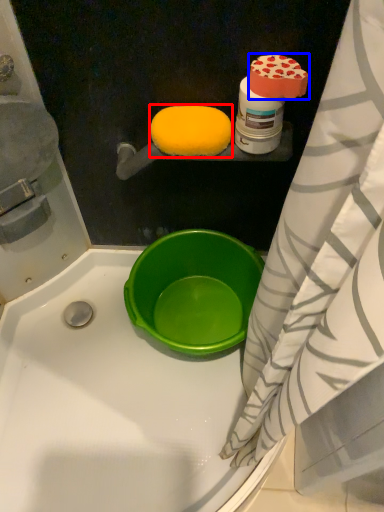
Question: Which object appears closest to the camera in this image, food (highlighted by a red box) or food (highlighted by a blue box)?

Choices:
 (A) food
 (B) food

Answer: (B)